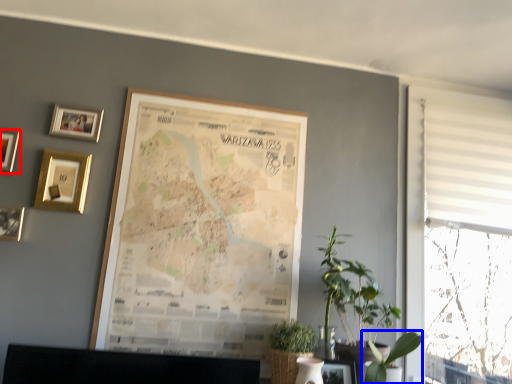
Question: Which of the following is the closest to the observer, picture frame (highlighted by a red box) or plant (highlighted by a blue box)?

Choices:
 (A) picture frame
 (B) plant

Answer: (B)